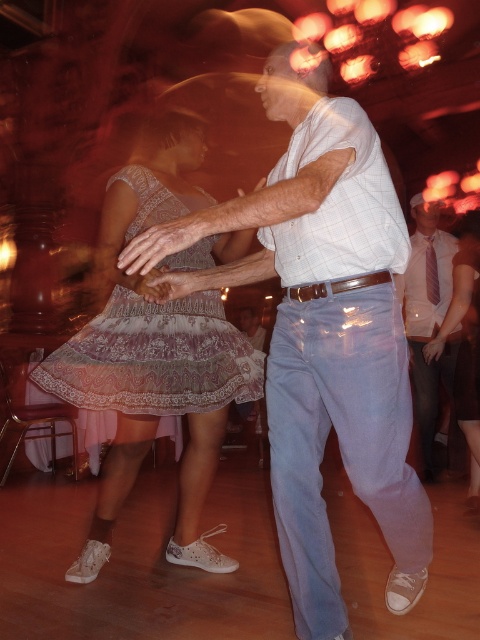
Is white checkered shirt at center behind pink striped tie at center?

No, it is in front of pink striped tie at center.

Is white checkered shirt at center positioned before pink striped tie at center?

Yes.

The image size is (480, 640). What do you see at coordinates (323, 333) in the screenshot? I see `white checkered shirt at center` at bounding box center [323, 333].

In order to click on white checkered shirt at center in this screenshot , I will do `click(323, 333)`.

What do you see at coordinates (323, 333) in the screenshot? I see `white checkered shirt at center` at bounding box center [323, 333].

Does point (360, 176) come behind point (477, 260)?

No, it is in front of (477, 260).

This screenshot has height=640, width=480. What are the coordinates of `white checkered shirt at center` in the screenshot? It's located at (323, 333).

Can you confirm if pink striped tie at center is thinner than lace fabric skirt at center?

Incorrect, pink striped tie at center's width is not less than lace fabric skirt at center's.

Is pink striped tie at center further to camera compared to lace fabric skirt at center?

Yes, pink striped tie at center is behind lace fabric skirt at center.

What do you see at coordinates (428, 316) in the screenshot? I see `pink striped tie at center` at bounding box center [428, 316].

I want to click on pink striped tie at center, so click(x=428, y=316).